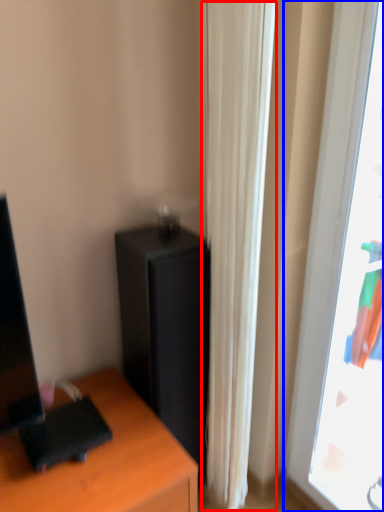
Question: Among these objects, which one is nearest to the camera, curtain (highlighted by a red box) or window (highlighted by a blue box)?

Choices:
 (A) curtain
 (B) window

Answer: (B)